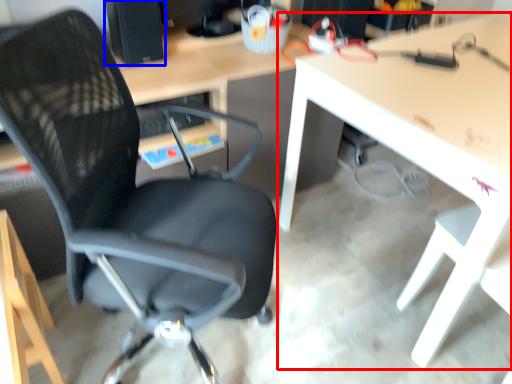
Question: Among these objects, which one is farthest to the camera, table (highlighted by a red box) or desktop computer (highlighted by a blue box)?

Choices:
 (A) table
 (B) desktop computer

Answer: (B)